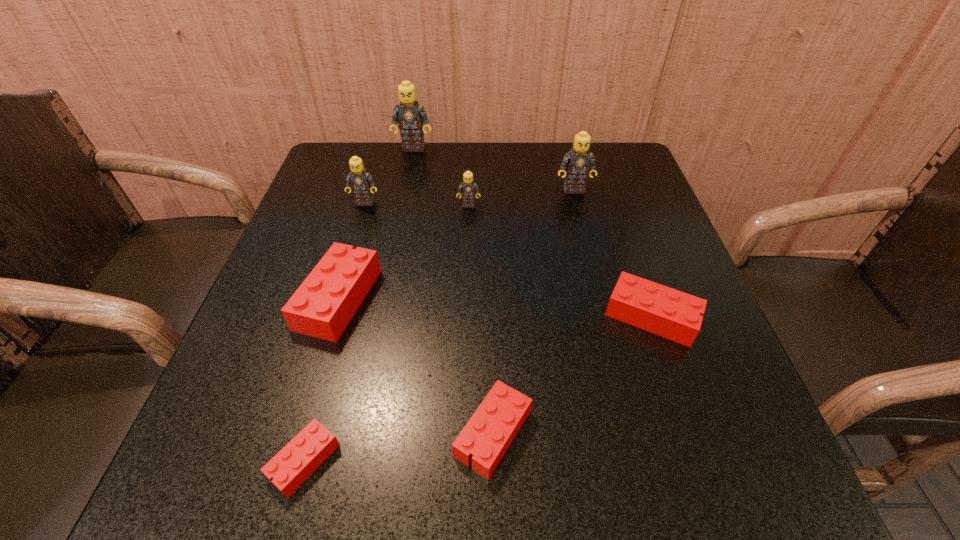
Identify the location of vacant point located on the back of the biggest red Lego. (376, 173).

Where is `vacant region located 0.150m on the front of the sixth tallest object`? The height and width of the screenshot is (540, 960). vacant region located 0.150m on the front of the sixth tallest object is located at coordinates (691, 432).

At what (x,y) coordinates should I click in order to perform the action: click on free region located on the right of the third biggest red Lego. Please return your answer as a coordinate pair (x, y). The image size is (960, 540). Looking at the image, I should click on (608, 433).

Where is `vacant space located on the back of the shortest object`? The width and height of the screenshot is (960, 540). vacant space located on the back of the shortest object is located at coordinates (361, 253).

You are a GUI agent. You are given a task and a screenshot of the screen. Output one action in this format:
    pyautogui.click(x=<x>, y=<y>)
    Task: Click on the object located at the near left corner
    
    Given the screenshot: What is the action you would take?
    pyautogui.click(x=293, y=464)

Where is `object located at the far right corner`? object located at the far right corner is located at coordinates (578, 162).

In the image, there is a desktop. Identify the location of vacant space at the far edge. (408, 156).

In the image, there is a desktop. At what (x,y) coordinates should I click in order to perform the action: click on vacant space at the left edge. Please return your answer as a coordinate pair (x, y). This screenshot has width=960, height=540. Looking at the image, I should click on (293, 376).

In the image, there is a desktop. At what (x,y) coordinates should I click in order to perform the action: click on vacant space at the right edge. Please return your answer as a coordinate pair (x, y). This screenshot has width=960, height=540. Looking at the image, I should click on (665, 394).

I want to click on blank space at the far left corner, so click(x=363, y=144).